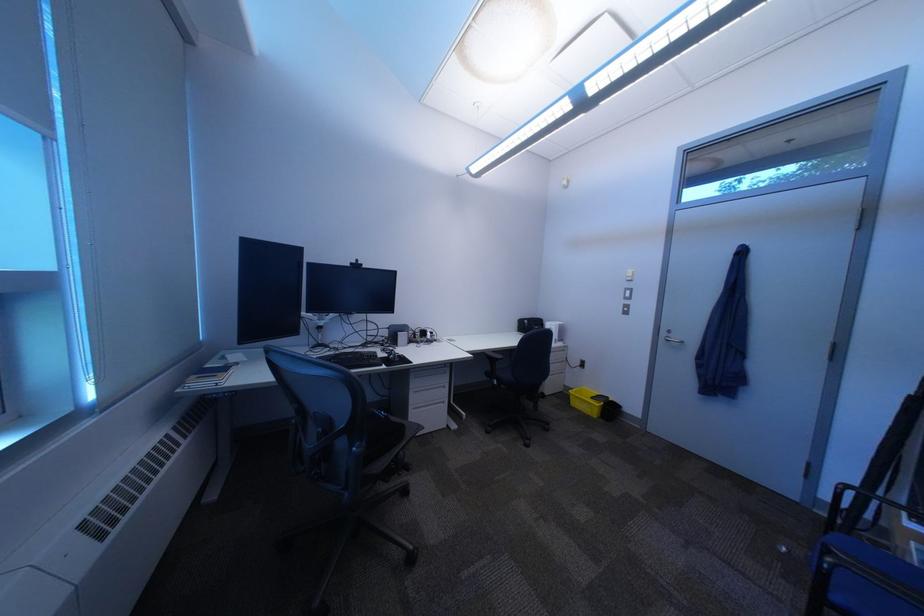
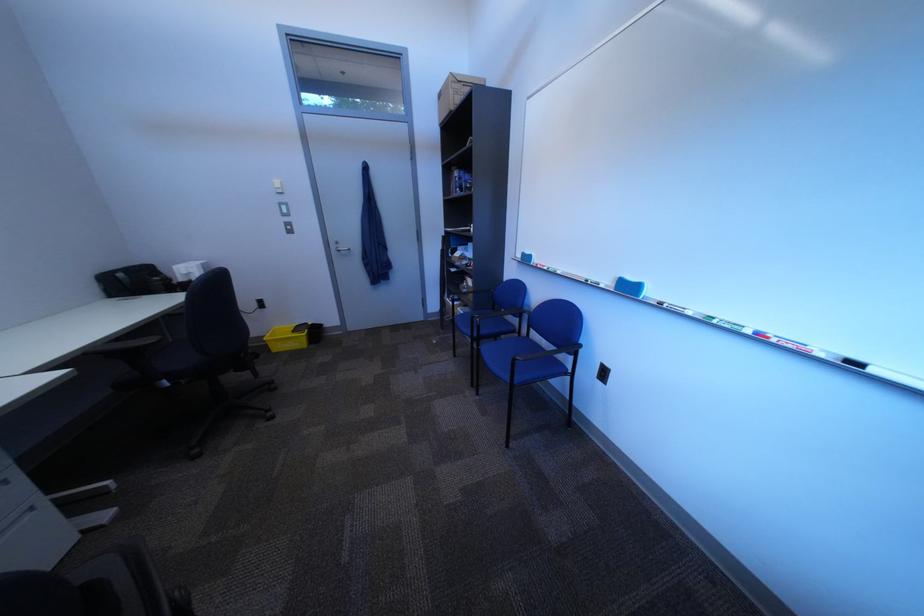
Consider the image. Based on the continuous images, in which direction is the camera rotating?

The rotation direction of the camera is right-down.